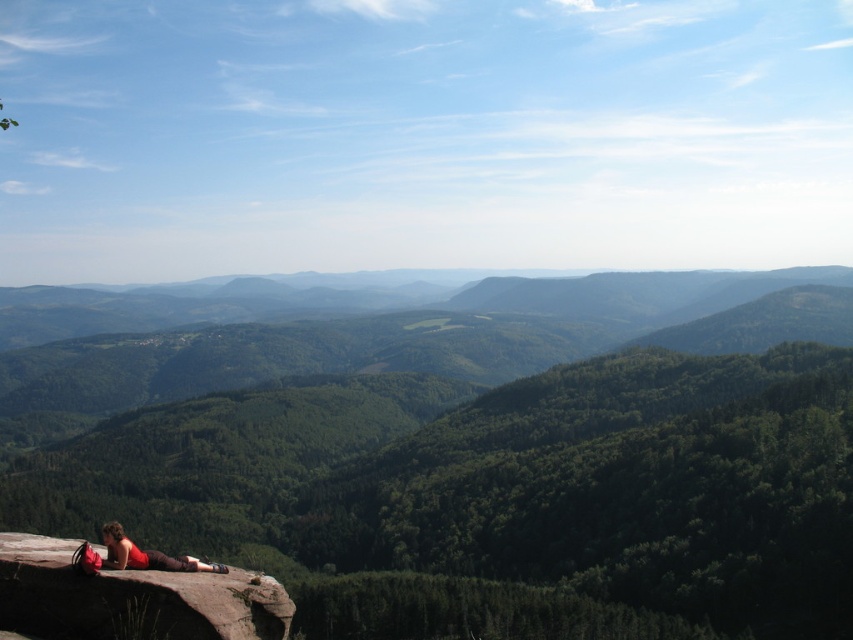
Question: Which of the following is the farthest from the observer?

Choices:
 (A) matte red shirt at lower left
 (B) brown rough cliff at lower left

Answer: (A)

Question: Can you confirm if brown rough cliff at lower left is positioned below matte red shirt at lower left?

Choices:
 (A) yes
 (B) no

Answer: (A)

Question: Does brown rough cliff at lower left have a smaller size compared to matte red shirt at lower left?

Choices:
 (A) no
 (B) yes

Answer: (A)

Question: Which object appears closest to the camera in this image?

Choices:
 (A) brown rough cliff at lower left
 (B) matte red shirt at lower left

Answer: (A)

Question: Which object is farther from the camera taking this photo?

Choices:
 (A) matte red shirt at lower left
 (B) brown rough cliff at lower left

Answer: (A)

Question: Can you confirm if brown rough cliff at lower left is positioned above matte red shirt at lower left?

Choices:
 (A) yes
 (B) no

Answer: (B)